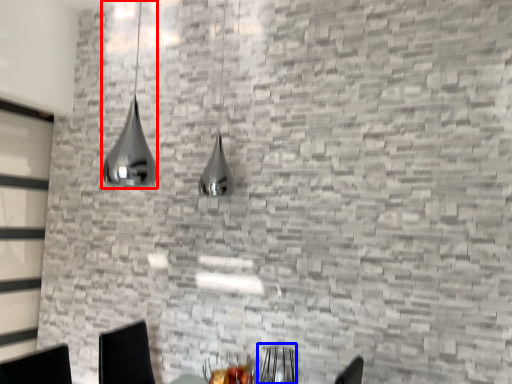
Question: Which object appears closest to the camera in this image, lamp (highlighted by a red box) or armchair (highlighted by a blue box)?

Choices:
 (A) lamp
 (B) armchair

Answer: (A)